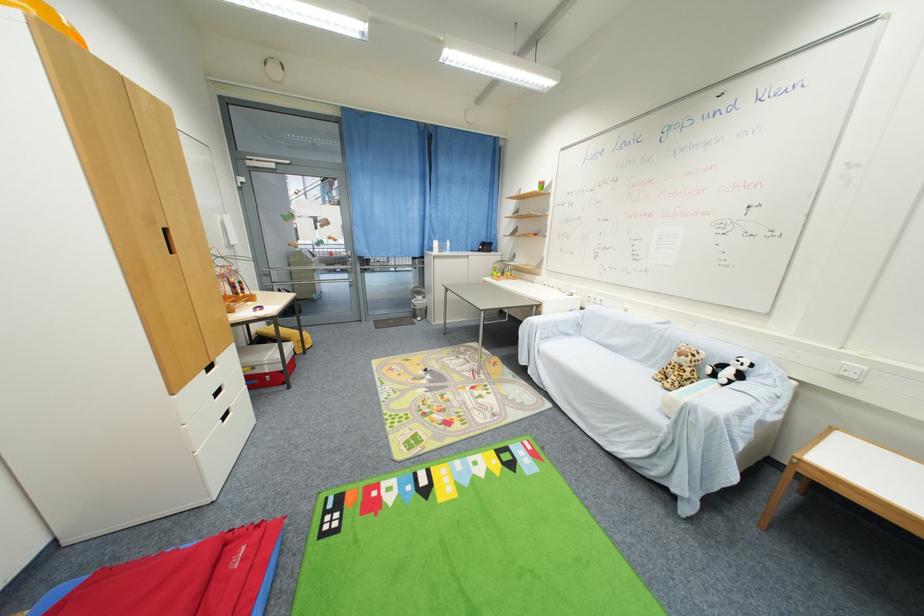
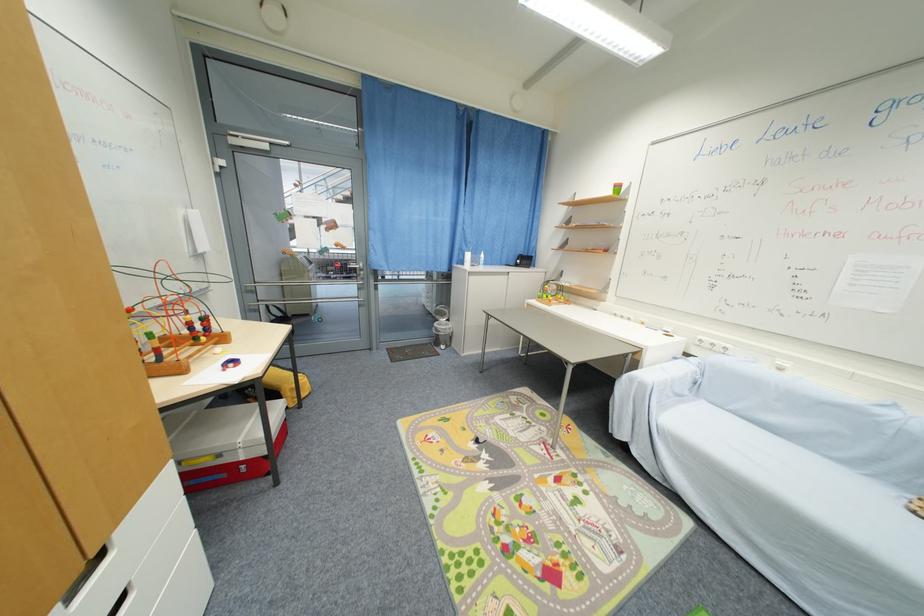
Question: The camera is either moving clockwise (left) or counter-clockwise (right) around the object. The first image is from the beginning of the video and the second image is from the end. Is the camera moving left or right when shooting the video?

Choices:
 (A) Left
 (B) Right

Answer: (A)